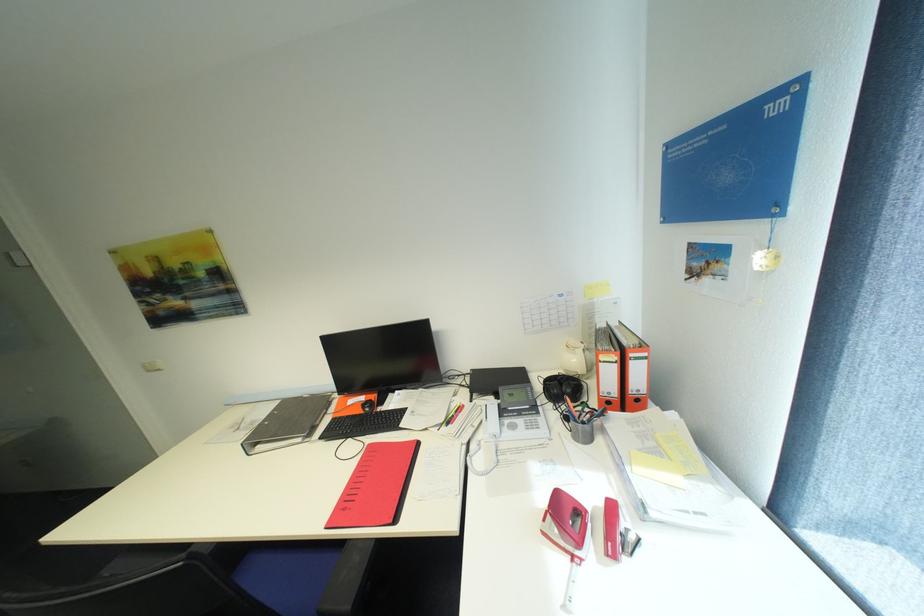
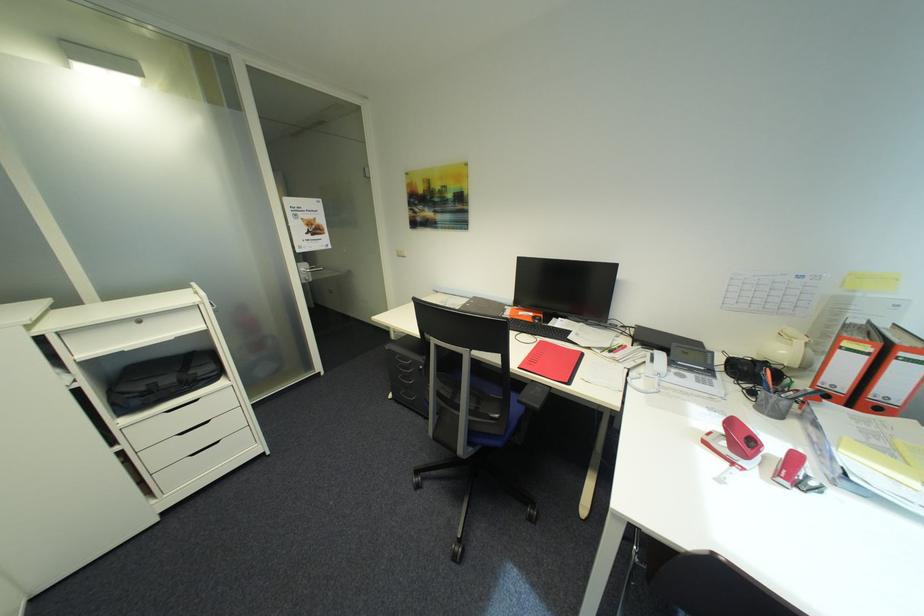
Find the pixel in the second image that matches [575,419] in the first image.

(760, 392)